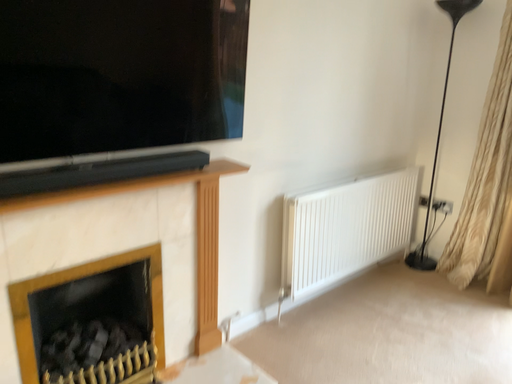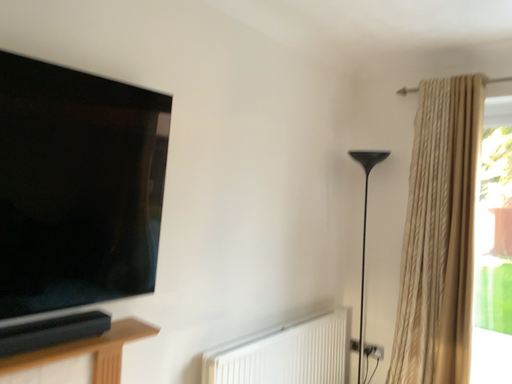
Question: Which way did the camera rotate in the video?

Choices:
 (A) rotated left
 (B) rotated right

Answer: (B)